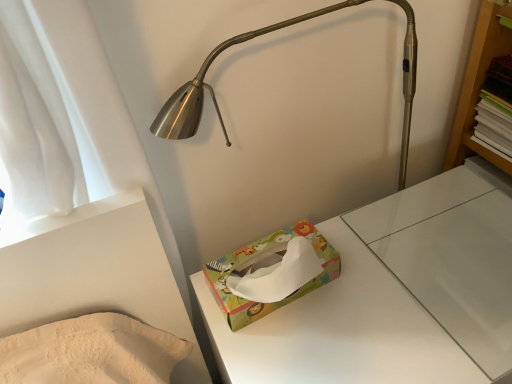
Identify the location of spots to the right of multicolored paper tissue box at center. This screenshot has width=512, height=384. (377, 280).